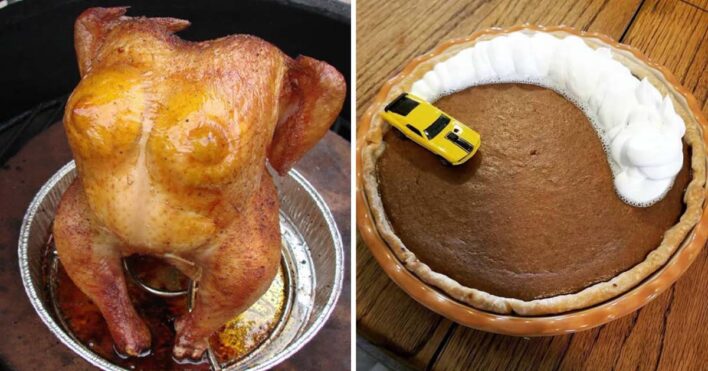
Find the location of a particular element. Image resolution: width=708 pixels, height=371 pixels. silver aluminum baking bowl is located at coordinates (311, 241).